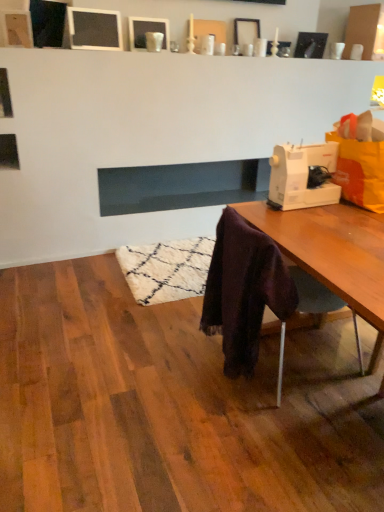
Identify the location of vacant space underneath velvet purple scarf at lower right (from a real-world perspective). (284, 376).